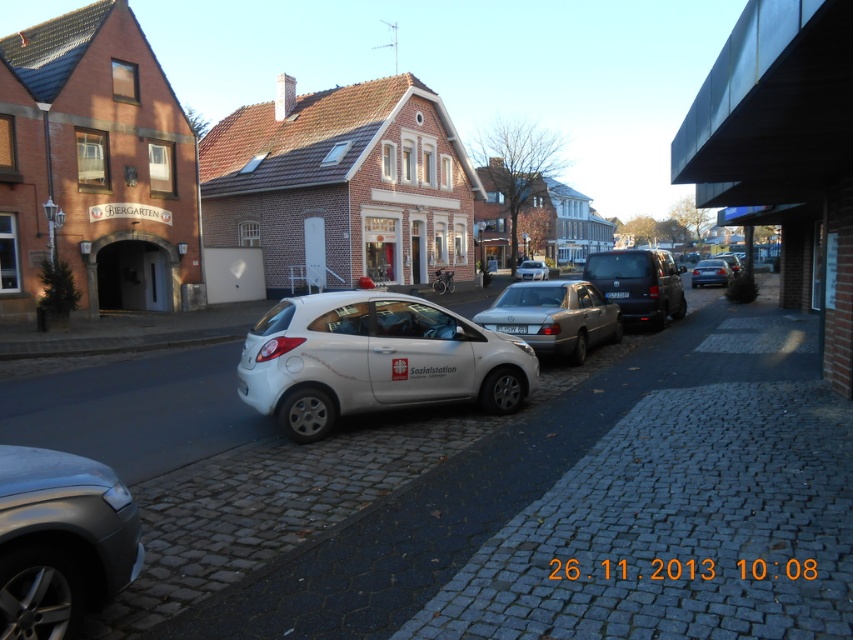
Which is behind, point (552, 348) or point (621, 296)?

Point (621, 296)

Does silver metallic sedan at center appear on the right side of black plastic license plate at center?

Incorrect, silver metallic sedan at center is not on the right side of black plastic license plate at center.

Is point (549, 284) more distant than point (618, 291)?

No, (549, 284) is closer to viewer.

Image resolution: width=853 pixels, height=640 pixels. Identify the location of silver metallic sedan at center. (555, 316).

Can you confirm if silver metallic car at lower left is shorter than metallic silver sedan at center-right?

Indeed, silver metallic car at lower left has a lesser height compared to metallic silver sedan at center-right.

How far apart are silver metallic car at lower left and metallic silver sedan at center-right?

They are 35.35 meters apart.

Find the location of `silver metallic car at lower left`. silver metallic car at lower left is located at coordinates (61, 540).

Where is `silver metallic car at lower left`? This screenshot has width=853, height=640. silver metallic car at lower left is located at coordinates (61, 540).

Who is shorter, white matte car at center or shiny black van at center?

Standing shorter between the two is white matte car at center.

In the scene shown: Is white matte car at center taller than shiny black van at center?

In fact, white matte car at center may be shorter than shiny black van at center.

Who is more forward, (387, 292) or (669, 314)?

Point (387, 292) is more forward.

Find the location of a particular element. The image size is (853, 640). white matte car at center is located at coordinates (374, 358).